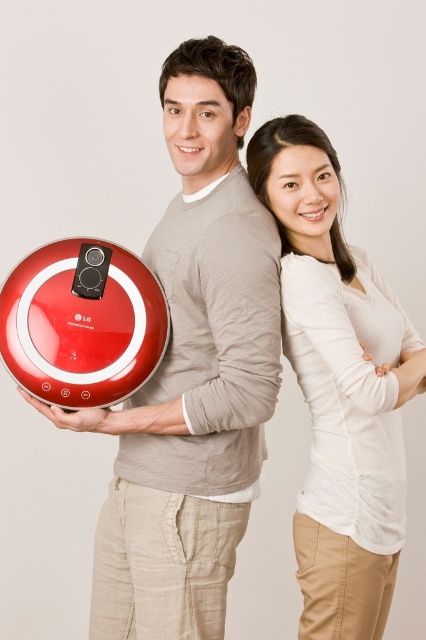
Question: Which object is closer to the camera taking this photo?

Choices:
 (A) matte white blouse at center
 (B) metallic red robot vacuum cleaner at left

Answer: (B)

Question: Which object is the closest to the red plastic vacuum cleaner at lower left?

Choices:
 (A) matte white blouse at center
 (B) metallic red robot vacuum cleaner at left

Answer: (B)

Question: Which object is positioned farthest from the metallic red robot vacuum cleaner at left?

Choices:
 (A) red plastic vacuum cleaner at lower left
 (B) matte white blouse at center

Answer: (B)

Question: In this image, where is metallic red robot vacuum cleaner at left located relative to red plastic vacuum cleaner at lower left?

Choices:
 (A) right
 (B) left

Answer: (A)

Question: Does metallic red robot vacuum cleaner at left have a larger size compared to matte white blouse at center?

Choices:
 (A) yes
 (B) no

Answer: (A)

Question: Is matte white blouse at center to the right of red plastic vacuum cleaner at lower left from the viewer's perspective?

Choices:
 (A) yes
 (B) no

Answer: (A)